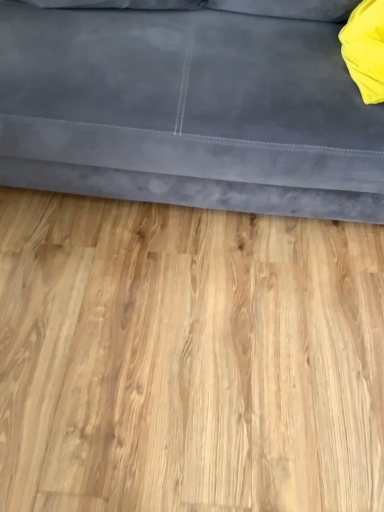
Question: Can you confirm if suede gray couch at upper center is smaller than light wood flooring at center?

Choices:
 (A) no
 (B) yes

Answer: (A)

Question: Is suede gray couch at upper center oriented away from light wood flooring at center?

Choices:
 (A) no
 (B) yes

Answer: (A)

Question: From the image's perspective, would you say suede gray couch at upper center is shown under light wood flooring at center?

Choices:
 (A) yes
 (B) no

Answer: (B)

Question: Is suede gray couch at upper center closer to the viewer compared to light wood flooring at center?

Choices:
 (A) no
 (B) yes

Answer: (B)

Question: Would you say suede gray couch at upper center is outside light wood flooring at center?

Choices:
 (A) yes
 (B) no

Answer: (A)

Question: Does suede gray couch at upper center have a larger size compared to light wood flooring at center?

Choices:
 (A) yes
 (B) no

Answer: (A)

Question: From a real-world perspective, does yellow fabric pillow at upper right sit lower than suede gray couch at upper center?

Choices:
 (A) no
 (B) yes

Answer: (A)

Question: Is yellow fabric pillow at upper right positioned beyond the bounds of suede gray couch at upper center?

Choices:
 (A) no
 (B) yes

Answer: (A)

Question: Can you confirm if yellow fabric pillow at upper right is taller than suede gray couch at upper center?

Choices:
 (A) yes
 (B) no

Answer: (B)

Question: Is suede gray couch at upper center at the back of yellow fabric pillow at upper right?

Choices:
 (A) no
 (B) yes

Answer: (B)

Question: Does yellow fabric pillow at upper right appear on the right side of suede gray couch at upper center?

Choices:
 (A) no
 (B) yes

Answer: (B)

Question: Could you tell me if yellow fabric pillow at upper right is facing suede gray couch at upper center?

Choices:
 (A) no
 (B) yes

Answer: (B)

Question: Considering the relative sizes of suede gray couch at upper center and yellow fabric pillow at upper right in the image provided, is suede gray couch at upper center wider than yellow fabric pillow at upper right?

Choices:
 (A) yes
 (B) no

Answer: (A)